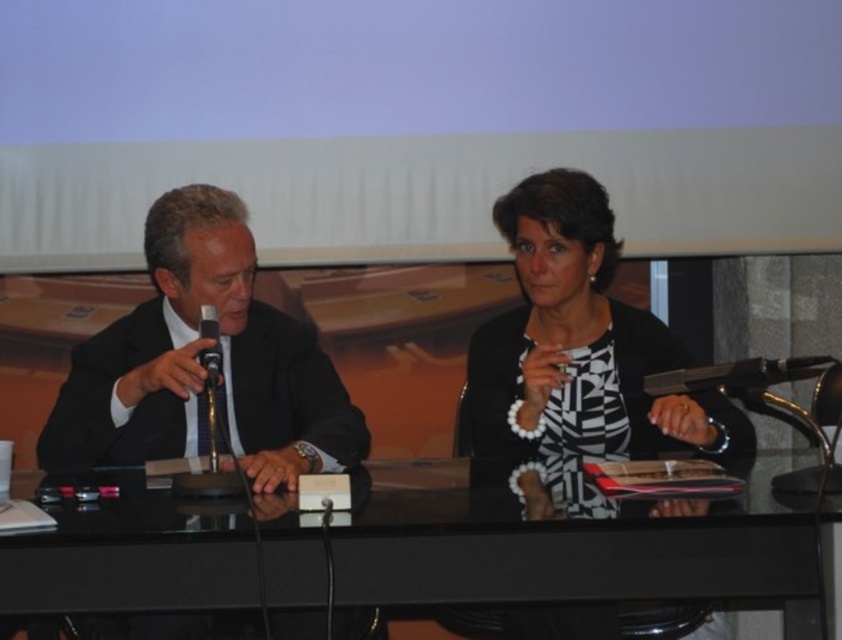
This screenshot has height=640, width=842. In order to click on black glass table at center in this screenshot , I will do `click(569, 547)`.

Can you confirm if black glass table at center is wider than black suit at left?

Yes.

Does point (324, 593) lie in front of point (228, 337)?

Yes, point (324, 593) is in front of point (228, 337).

You are a GUI agent. You are given a task and a screenshot of the screen. Output one action in this format:
    pyautogui.click(x=<x>, y=<y>)
    Task: Click on the black glass table at center
    The image size is (842, 640).
    Given the screenshot: What is the action you would take?
    pyautogui.click(x=569, y=547)

Does black glass table at center lie in front of black and white striped blouse at center?

Yes.

Which is more to the right, black glass table at center or black and white striped blouse at center?

Positioned to the right is black and white striped blouse at center.

Between point (610, 550) and point (571, 355), which one is positioned in front?

Point (610, 550)

This screenshot has width=842, height=640. I want to click on black glass table at center, so click(569, 547).

Looking at this image, is black suit at left to the right of black plastic microphone at left from the viewer's perspective?

Incorrect, black suit at left is not on the right side of black plastic microphone at left.

Can you confirm if black suit at left is thinner than black plastic microphone at left?

In fact, black suit at left might be wider than black plastic microphone at left.

Find the location of a particular element. The height and width of the screenshot is (640, 842). black suit at left is located at coordinates (200, 365).